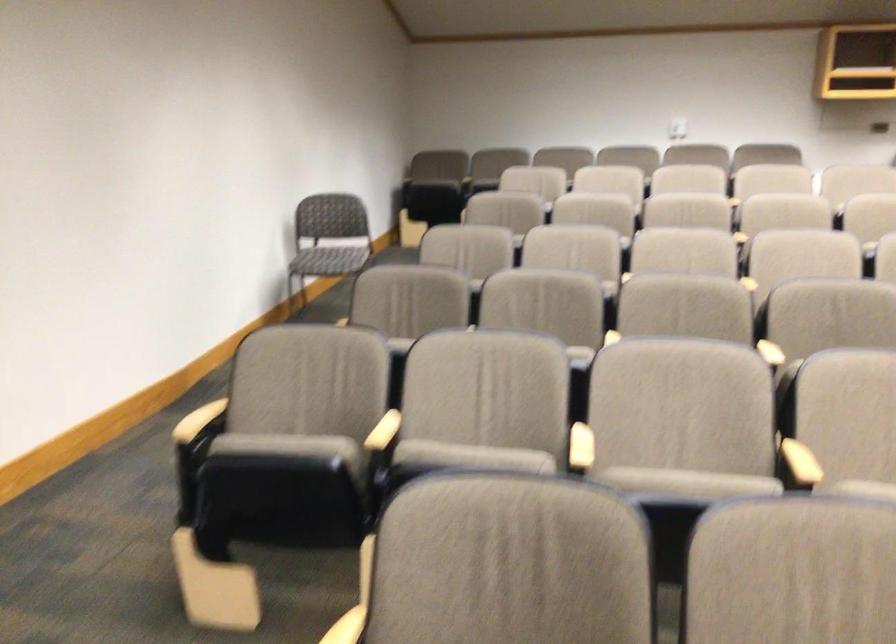
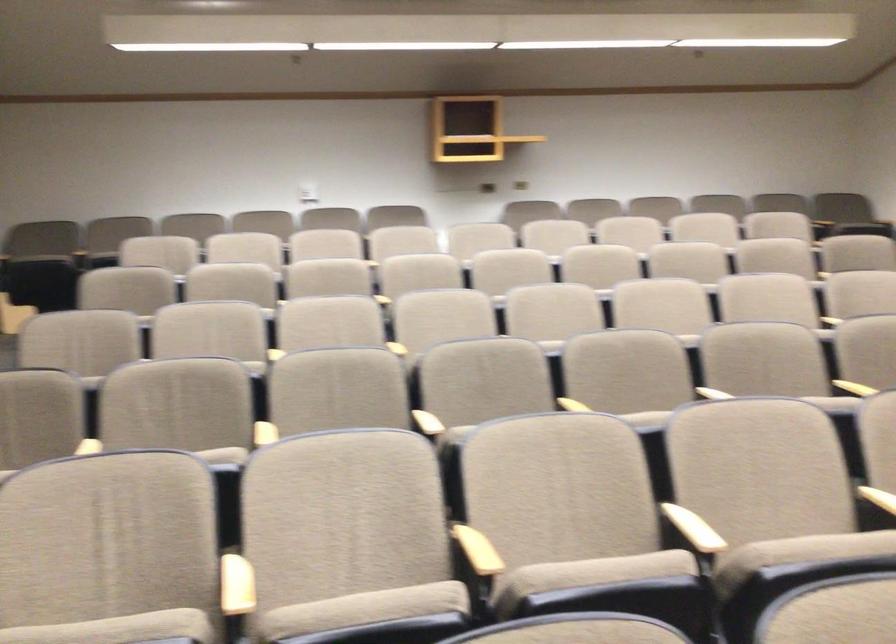
The point at (580, 444) is marked in the first image. Where is the corresponding point in the second image?

(236, 585)